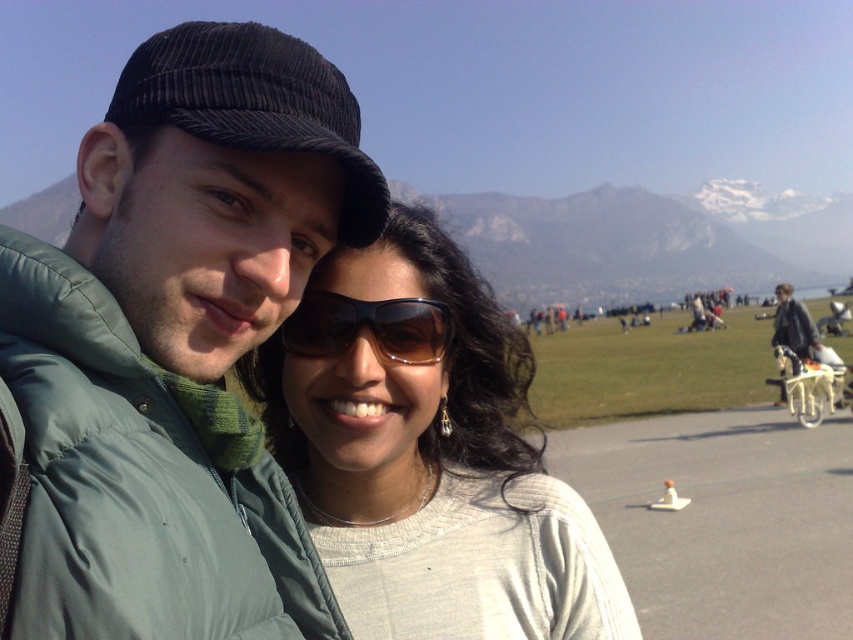
Is matte white sweater at center further to the viewer compared to brown matte sunglasses at center?

Yes, it is.

Is point (376, 273) more distant than point (312, 294)?

Yes, point (376, 273) is farther from viewer.

Locate an element on the screen. The height and width of the screenshot is (640, 853). matte white sweater at center is located at coordinates (427, 452).

Who is higher up, green puffy jacket at center or brown matte sunglasses at center?

Positioned higher is green puffy jacket at center.

Is green puffy jacket at center to the left of brown matte sunglasses at center from the viewer's perspective?

Yes, green puffy jacket at center is to the left of brown matte sunglasses at center.

Between point (64, 394) and point (410, 337), which one is positioned behind?

Point (410, 337)

At what (x,y) coordinates should I click in order to perform the action: click on green puffy jacket at center. Please return your answer as a coordinate pair (x, y). This screenshot has height=640, width=853. Looking at the image, I should click on (173, 346).

Is point (126, 321) positioned before point (422, 332)?

Yes.

Describe the element at coordinates (173, 346) in the screenshot. I see `green puffy jacket at center` at that location.

At what (x,y) coordinates should I click in order to perform the action: click on green puffy jacket at center. Please return your answer as a coordinate pair (x, y). The height and width of the screenshot is (640, 853). Looking at the image, I should click on (173, 346).